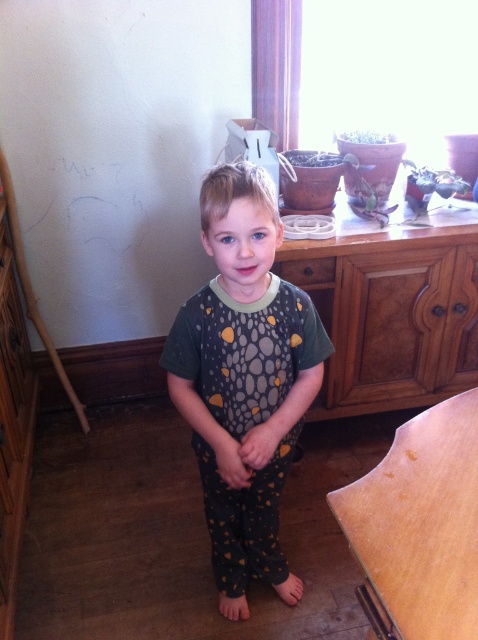
Question: Which is farther from the brown wood dresser at center?

Choices:
 (A) dark green jersey at center
 (B) wooden at center

Answer: (B)

Question: Is brown wood dresser at center to the left of wooden at center from the viewer's perspective?

Choices:
 (A) no
 (B) yes

Answer: (A)

Question: Which of these objects is positioned farthest from the dark green jersey at center?

Choices:
 (A) wooden at center
 (B) brown wood dresser at center

Answer: (B)

Question: Is dark green jersey at center to the right of wooden at center from the viewer's perspective?

Choices:
 (A) yes
 (B) no

Answer: (B)

Question: Which of the following is the closest to the observer?

Choices:
 (A) [329, 413]
 (B) [245, 307]
 (C) [390, 589]

Answer: (C)

Question: Is dark green jersey at center in front of wooden at center?

Choices:
 (A) yes
 (B) no

Answer: (B)